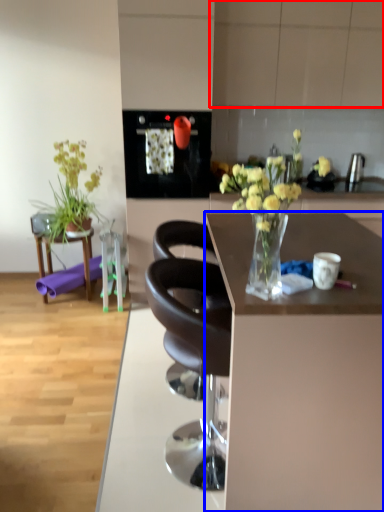
Question: Among these objects, which one is farthest to the camera, cabinetry (highlighted by a red box) or desk (highlighted by a blue box)?

Choices:
 (A) cabinetry
 (B) desk

Answer: (A)